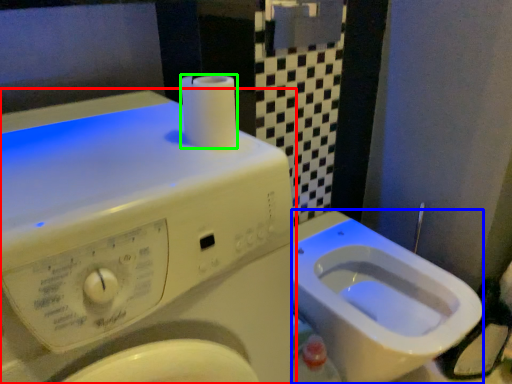
Question: Estimate the real-world distances between objects in this image. Which object is closer to washing machine (highlighted by a red box), bidet (highlighted by a blue box) or toilet paper (highlighted by a green box)?

Choices:
 (A) bidet
 (B) toilet paper

Answer: (B)